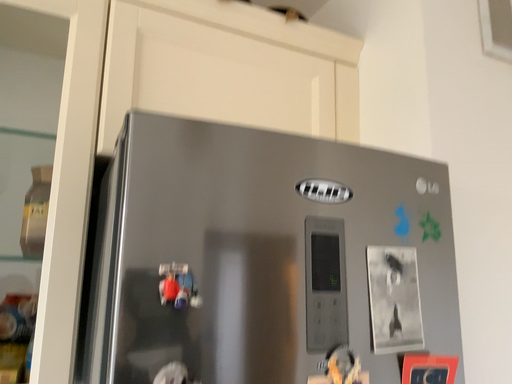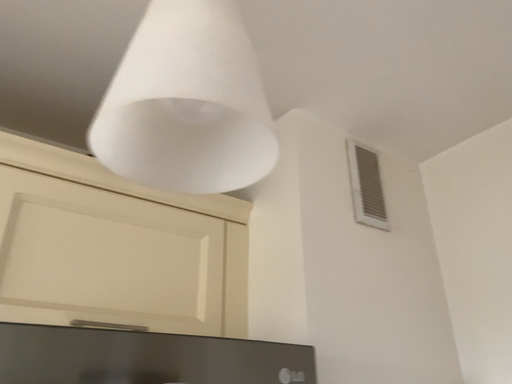
Question: Which way did the camera rotate in the video?

Choices:
 (A) rotated right
 (B) rotated left

Answer: (A)